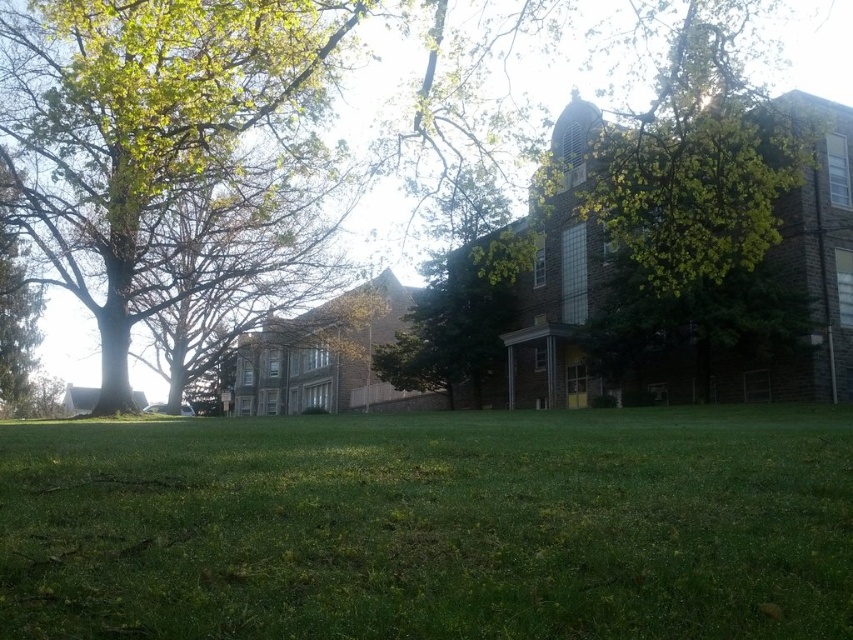
You are standing on the lawn in front of the building and want to determine which tree is taller between the green leafy tree at upper left and the green leafy tree at upper center. Based on their positions, which one appears taller?

The green leafy tree at upper center is taller than the green leafy tree at upper left.

You are a landscape architect designing a new pathway that needs to pass between the green leafy tree at upper left and the green leafy tree at upper center. Based on their thickness, which tree would require more space to avoid damaging its roots?

The green leafy tree at upper center would require more space because it is thicker than the green leafy tree at upper left, so its root system is likely larger and needs more room to avoid damage.